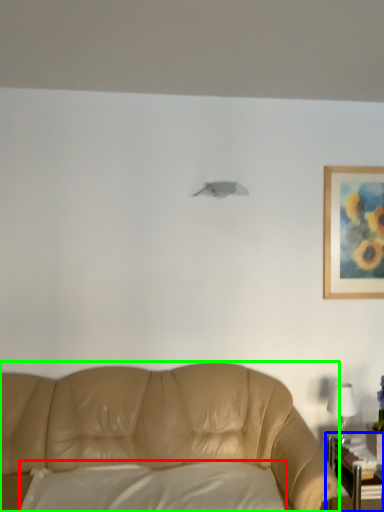
Question: Which is nearer to the pillow (highlighted by a red box)? table (highlighted by a blue box) or studio couch (highlighted by a green box).

Choices:
 (A) table
 (B) studio couch

Answer: (B)